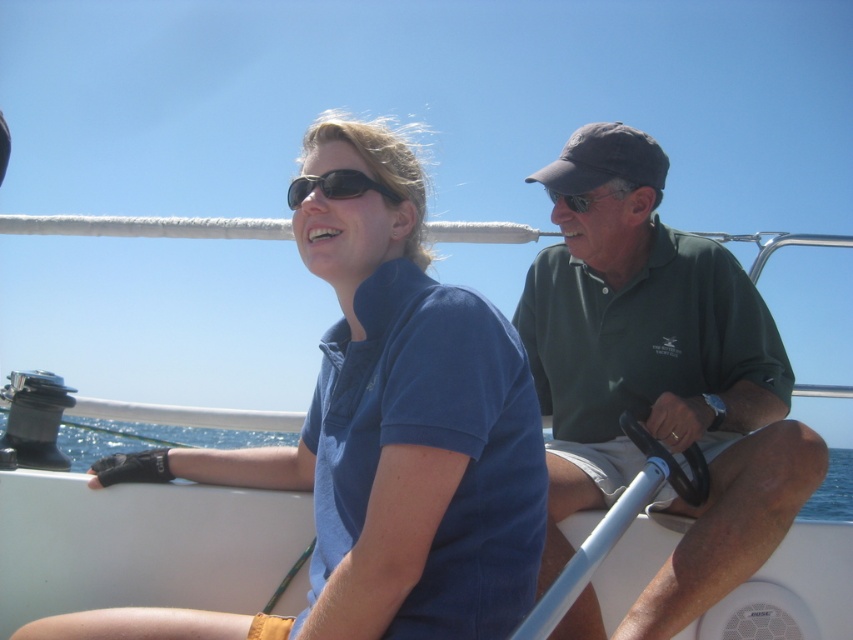
Question: Which is nearer to the blue cotton shirt at center?

Choices:
 (A) blue water at lower left
 (B) matte black sunglasses at center

Answer: (B)

Question: Can you confirm if blue cotton shirt at center is positioned to the right of matte black sunglasses at center?

Choices:
 (A) no
 (B) yes

Answer: (A)

Question: Does green cotton shirt at right have a greater width compared to blue water at lower left?

Choices:
 (A) no
 (B) yes

Answer: (A)

Question: In this image, where is blue cotton shirt at center located relative to green cotton shirt at right?

Choices:
 (A) above
 (B) below

Answer: (B)

Question: Estimate the real-world distances between objects in this image. Which object is farther from the blue cotton shirt at center?

Choices:
 (A) green cotton shirt at right
 (B) blue water at lower left

Answer: (B)

Question: Which object is positioned closest to the blue water at lower left?

Choices:
 (A) matte black sunglasses at center
 (B) green cotton shirt at right

Answer: (A)